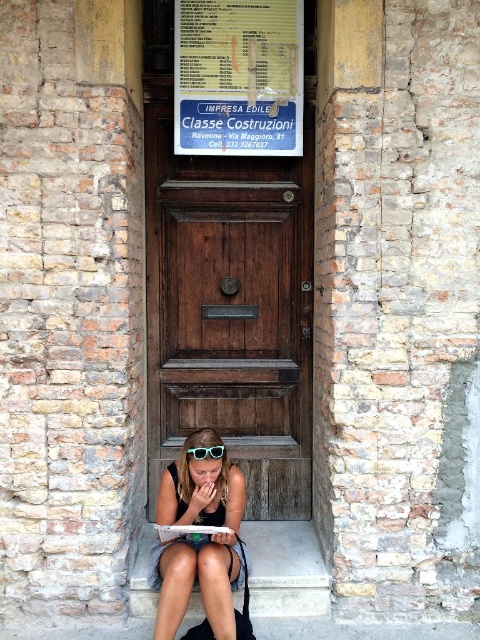
Can you confirm if matte blue sunglasses at lower center is thinner than smooth concrete stairs at lower center?

Indeed, matte blue sunglasses at lower center has a lesser width compared to smooth concrete stairs at lower center.

Does matte blue sunglasses at lower center come in front of smooth concrete stairs at lower center?

Yes, it is.

Does point (189, 500) come farther from viewer compared to point (287, 536)?

No.

Locate an element on the screen. This screenshot has width=480, height=640. matte blue sunglasses at lower center is located at coordinates (200, 538).

Does wooden door at center appear on the right side of matte blue sunglasses at lower center?

Indeed, wooden door at center is positioned on the right side of matte blue sunglasses at lower center.

Does wooden door at center appear on the left side of matte blue sunglasses at lower center?

In fact, wooden door at center is to the right of matte blue sunglasses at lower center.

Does point (273, 241) come closer to viewer compared to point (235, 474)?

That is False.

The image size is (480, 640). I want to click on wooden door at center, so click(x=229, y=308).

Who is shorter, wooden door at center or smooth concrete stairs at lower center?

With less height is smooth concrete stairs at lower center.

Find the location of a particular element. This screenshot has height=640, width=480. wooden door at center is located at coordinates coord(229,308).

What are the coordinates of `wooden door at center` in the screenshot? It's located at (229, 308).